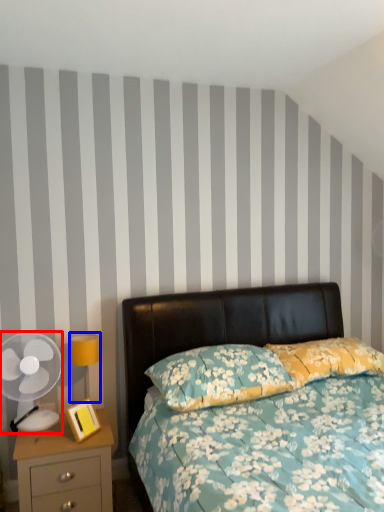
Question: Which object is further to the camera taking this photo, mechanical fan (highlighted by a red box) or bedside lamp (highlighted by a blue box)?

Choices:
 (A) mechanical fan
 (B) bedside lamp

Answer: (B)